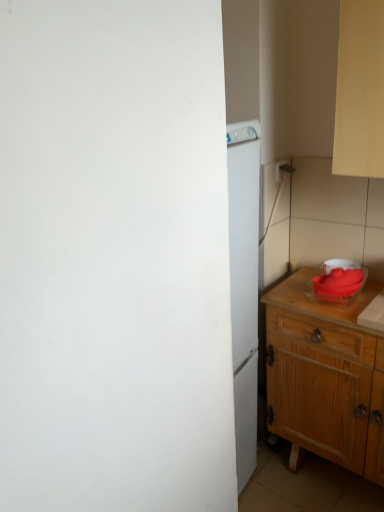
I want to click on vacant area to the left of matte red bowl at right, so click(x=296, y=293).